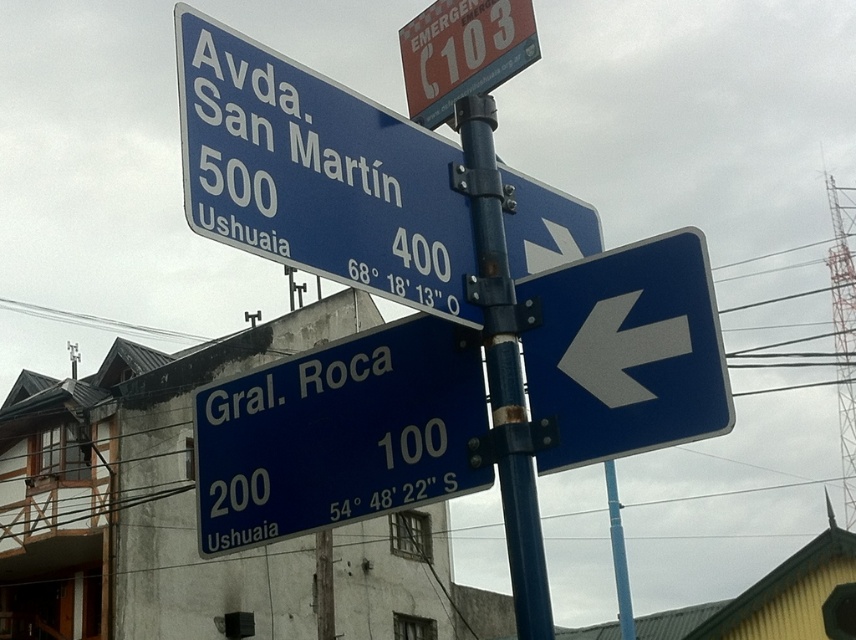
Question: Among these points, which one is farthest from the camera?

Choices:
 (A) (302, 436)
 (B) (191, 38)
 (C) (483, 90)

Answer: (C)

Question: Is blue metallic sign at lower left to the right of metallic emergency sign at upper center from the viewer's perspective?

Choices:
 (A) yes
 (B) no

Answer: (B)

Question: Among these objects, which one is farthest from the camera?

Choices:
 (A) blue metallic sign at lower left
 (B) metallic emergency sign at upper center

Answer: (B)

Question: Estimate the real-world distances between objects in this image. Which object is farther from the blue metallic sign at lower left?

Choices:
 (A) metallic emergency sign at upper center
 (B) blue metallic street sign at upper center
 (C) metallic blue pole at center

Answer: (A)

Question: Does metallic blue pole at center have a lesser width compared to metallic emergency sign at upper center?

Choices:
 (A) no
 (B) yes

Answer: (B)

Question: Does blue metallic sign at lower left appear under metallic blue pole at center?

Choices:
 (A) yes
 (B) no

Answer: (A)